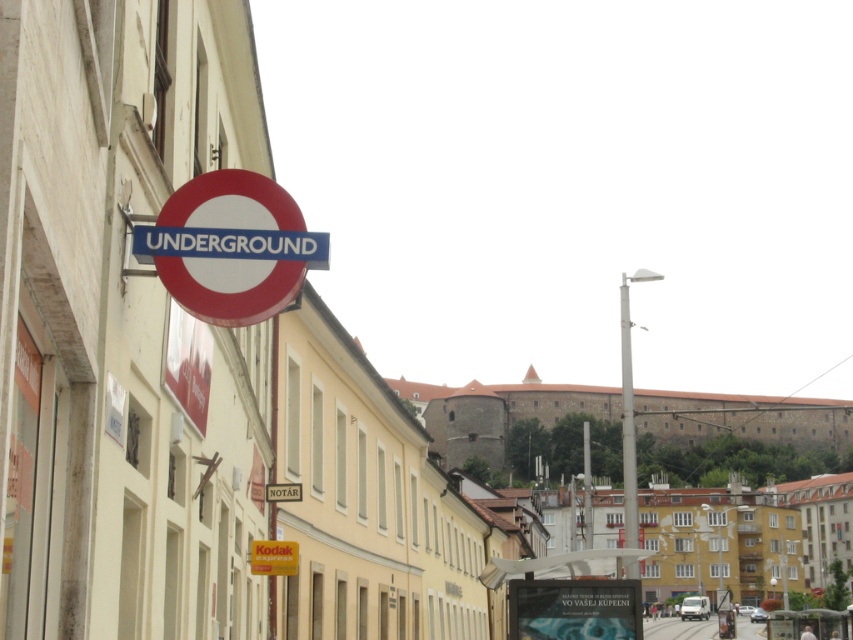
Question: Which object is the closest to the red circular sign at upper left?

Choices:
 (A) yellow matte kodak express sign at lower center
 (B) white plastic sign at upper center
 (C) blue plastic underground sign at upper center

Answer: (C)

Question: Does yellow matte kodak express sign at lower center appear on the right side of white plastic sign at upper center?

Choices:
 (A) yes
 (B) no

Answer: (B)

Question: Is yellow matte kodak express sign at lower center further to the viewer compared to white plastic sign at upper center?

Choices:
 (A) no
 (B) yes

Answer: (A)

Question: Is red circular sign at upper left bigger than yellow matte kodak express sign at lower center?

Choices:
 (A) yes
 (B) no

Answer: (A)

Question: Among these objects, which one is nearest to the camera?

Choices:
 (A) red circular sign at upper left
 (B) metallic silver bus stop at center
 (C) white metallic pole at center
 (D) blue plastic underground sign at upper center

Answer: (A)

Question: Which object is farther from the camera taking this photo?

Choices:
 (A) white metallic pole at center
 (B) yellow matte kodak express sign at lower center
 (C) metallic silver bus stop at center

Answer: (B)